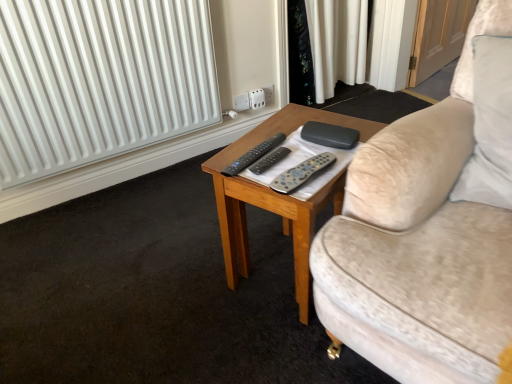
Locate an element on the screen. free space to the left of black matte case at center is located at coordinates (256, 138).